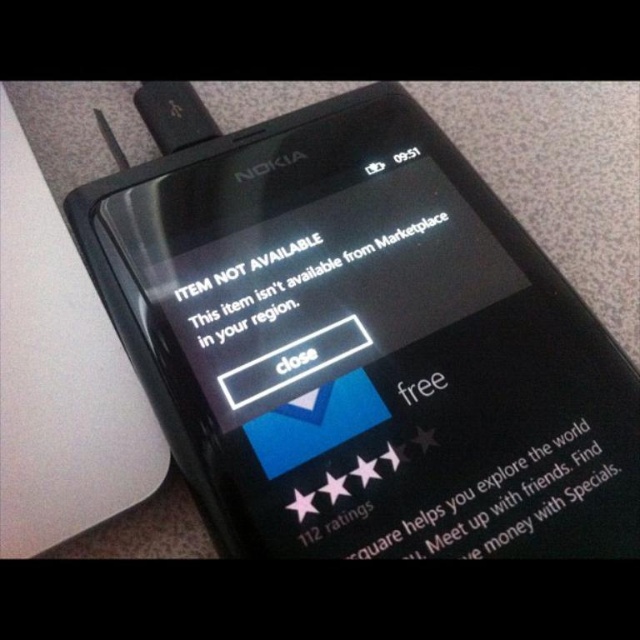
Based on the photo, measure the distance between point (218, 316) and camera.

Point (218, 316) and camera are 4.00 feet apart.

Based on the photo, can you confirm if black matte text at center is positioned to the left of white matte text at center?

Yes, black matte text at center is to the left of white matte text at center.

Who is more distant from viewer, [442,244] or [481,528]?

The point [442,244] is more distant.

This screenshot has height=640, width=640. What are the coordinates of `black matte text at center` in the screenshot? It's located at (317, 275).

Is black glossy smartphone at center bigger than black matte text at center?

Yes, black glossy smartphone at center is bigger than black matte text at center.

Can you confirm if black glossy smartphone at center is taller than black matte text at center?

Yes, black glossy smartphone at center is taller than black matte text at center.

The image size is (640, 640). What do you see at coordinates (358, 340) in the screenshot?
I see `black glossy smartphone at center` at bounding box center [358, 340].

This screenshot has height=640, width=640. In order to click on black glossy smartphone at center in this screenshot , I will do `click(358, 340)`.

Which is more to the right, black glossy smartphone at center or white matte text at center?

white matte text at center

Is point (333, 516) behind point (371, 506)?

No, (333, 516) is closer to viewer.

Where is `black glossy smartphone at center`? The image size is (640, 640). black glossy smartphone at center is located at coordinates (358, 340).